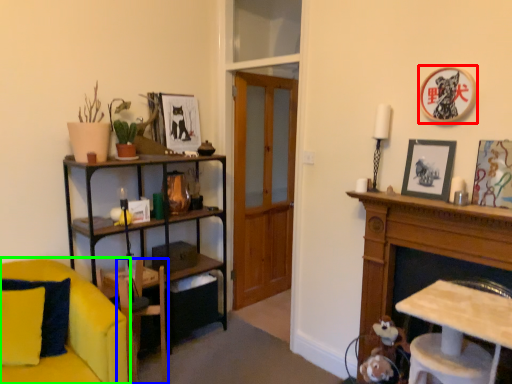
Question: Based on their relative distances, which object is farther from picture frame (highlighted by a red box)? Choose from armchair (highlighted by a blue box) and chair (highlighted by a green box).

Choices:
 (A) armchair
 (B) chair

Answer: (B)